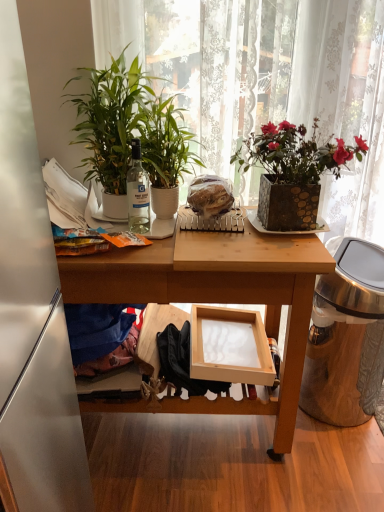
I want to click on free space on the front side of green leafy plant at center, which appears as the second houseplant when viewed from the left, so click(178, 245).